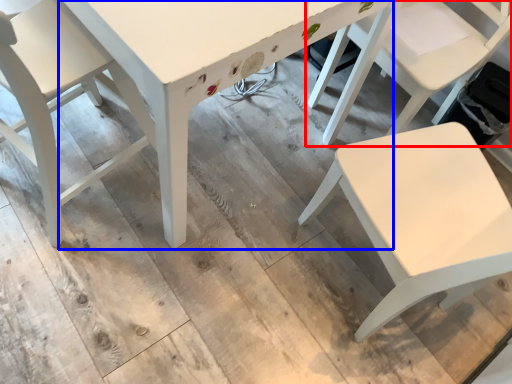
Question: Which object appears farthest to the camera in this image, chair (highlighted by a red box) or table (highlighted by a blue box)?

Choices:
 (A) chair
 (B) table

Answer: (A)